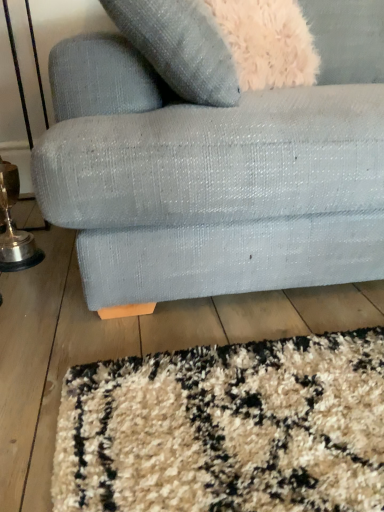
Question: Should I look upward or downward to see gold metallic table lamp at lower left?

Choices:
 (A) down
 (B) up

Answer: (B)

Question: Can gold metallic table lamp at lower left be found inside textured fabric couch at lower center?

Choices:
 (A) no
 (B) yes

Answer: (A)

Question: Does textured fabric couch at lower center appear on the right side of gold metallic table lamp at lower left?

Choices:
 (A) yes
 (B) no

Answer: (A)

Question: Does textured fabric couch at lower center have a greater width compared to gold metallic table lamp at lower left?

Choices:
 (A) no
 (B) yes

Answer: (B)

Question: Is textured fabric couch at lower center oriented away from gold metallic table lamp at lower left?

Choices:
 (A) yes
 (B) no

Answer: (B)

Question: Considering the relative sizes of textured fabric couch at lower center and gold metallic table lamp at lower left in the image provided, is textured fabric couch at lower center thinner than gold metallic table lamp at lower left?

Choices:
 (A) no
 (B) yes

Answer: (A)

Question: From a real-world perspective, does textured fabric couch at lower center sit lower than gold metallic table lamp at lower left?

Choices:
 (A) yes
 (B) no

Answer: (B)

Question: Is gold metallic table lamp at lower left bigger than textured fabric couch at lower center?

Choices:
 (A) yes
 (B) no

Answer: (B)

Question: Is gold metallic table lamp at lower left in front of textured fabric couch at lower center?

Choices:
 (A) yes
 (B) no

Answer: (B)

Question: Could textured fabric couch at lower center be considered to be inside gold metallic table lamp at lower left?

Choices:
 (A) yes
 (B) no

Answer: (B)

Question: Is gold metallic table lamp at lower left positioned beyond the bounds of textured fabric couch at lower center?

Choices:
 (A) no
 (B) yes

Answer: (B)

Question: From the image's perspective, is gold metallic table lamp at lower left located above textured fabric couch at lower center?

Choices:
 (A) yes
 (B) no

Answer: (B)

Question: Does gold metallic table lamp at lower left appear on the right side of textured fabric couch at lower center?

Choices:
 (A) yes
 (B) no

Answer: (B)

Question: Is textured fabric couch at lower center to the left or to the right of gold metallic table lamp at lower left in the image?

Choices:
 (A) left
 (B) right

Answer: (B)